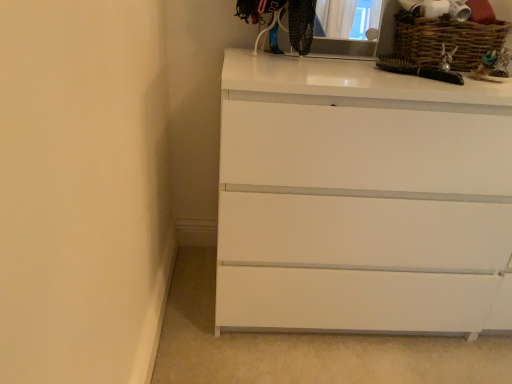
Question: Does matte black medicine cabinet at upper center have a smaller size compared to woven brown basket at upper right?

Choices:
 (A) yes
 (B) no

Answer: (A)

Question: Is matte black medicine cabinet at upper center shorter than woven brown basket at upper right?

Choices:
 (A) yes
 (B) no

Answer: (B)

Question: From a real-world perspective, is matte black medicine cabinet at upper center positioned over woven brown basket at upper right based on gravity?

Choices:
 (A) yes
 (B) no

Answer: (A)

Question: Is matte black medicine cabinet at upper center at the left side of woven brown basket at upper right?

Choices:
 (A) yes
 (B) no

Answer: (A)

Question: Is matte black medicine cabinet at upper center oriented towards woven brown basket at upper right?

Choices:
 (A) yes
 (B) no

Answer: (B)

Question: Considering the relative sizes of matte black medicine cabinet at upper center and woven brown basket at upper right in the image provided, is matte black medicine cabinet at upper center bigger than woven brown basket at upper right?

Choices:
 (A) no
 (B) yes

Answer: (A)

Question: Could you tell me if white glossy chest of drawers at center is facing matte black medicine cabinet at upper center?

Choices:
 (A) yes
 (B) no

Answer: (B)

Question: From the image's perspective, is white glossy chest of drawers at center located beneath matte black medicine cabinet at upper center?

Choices:
 (A) no
 (B) yes

Answer: (B)

Question: Is white glossy chest of drawers at center smaller than matte black medicine cabinet at upper center?

Choices:
 (A) yes
 (B) no

Answer: (B)

Question: Considering the relative positions of white glossy chest of drawers at center and matte black medicine cabinet at upper center in the image provided, is white glossy chest of drawers at center to the left of matte black medicine cabinet at upper center from the viewer's perspective?

Choices:
 (A) yes
 (B) no

Answer: (B)

Question: Can you confirm if white glossy chest of drawers at center is positioned to the right of matte black medicine cabinet at upper center?

Choices:
 (A) no
 (B) yes

Answer: (B)

Question: Considering the relative sizes of white glossy chest of drawers at center and matte black medicine cabinet at upper center in the image provided, is white glossy chest of drawers at center taller than matte black medicine cabinet at upper center?

Choices:
 (A) yes
 (B) no

Answer: (A)

Question: Is matte black medicine cabinet at upper center looking in the opposite direction of white glossy chest of drawers at center?

Choices:
 (A) yes
 (B) no

Answer: (B)